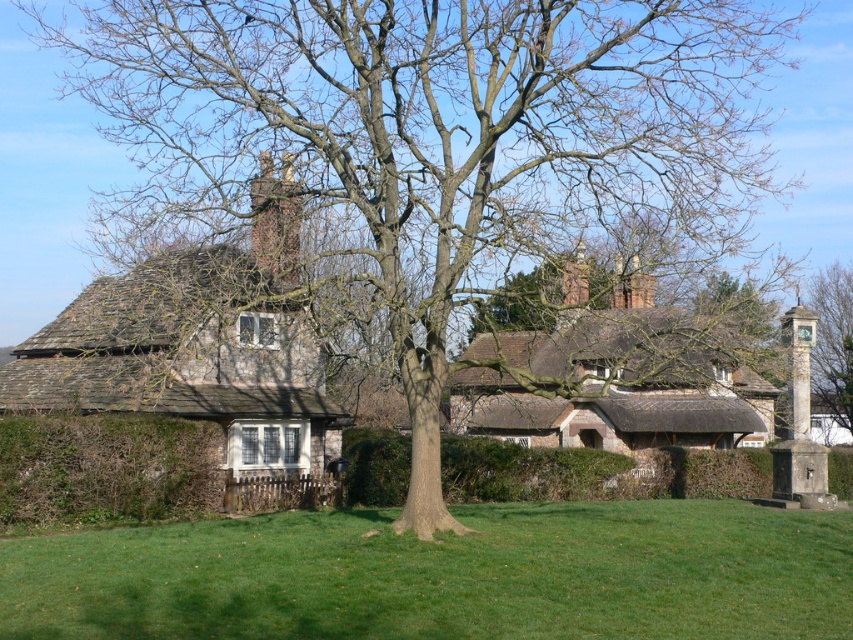
Question: Among these points, which one is farthest from the camera?

Choices:
 (A) (115, 504)
 (B) (828, 572)
 (C) (273, 177)
 (D) (62, 362)

Answer: (D)

Question: Considering the real-world distances, which object is farthest from the green grass at center?

Choices:
 (A) brown textured chimney at upper center
 (B) rustic stone cottage at left

Answer: (B)

Question: Does rustic stone cottage at left appear under thatched roof cottage at center?

Choices:
 (A) no
 (B) yes

Answer: (A)

Question: Does green grass at center have a greater width compared to rustic stone cottage at left?

Choices:
 (A) no
 (B) yes

Answer: (B)

Question: Can you confirm if green grass at center is thinner than green leafy hedge at lower left?

Choices:
 (A) yes
 (B) no

Answer: (B)

Question: Estimate the real-world distances between objects in this image. Which object is farther from the thatched roof cottage at center?

Choices:
 (A) brown textured chimney at upper center
 (B) green leafy hedge at lower left

Answer: (B)